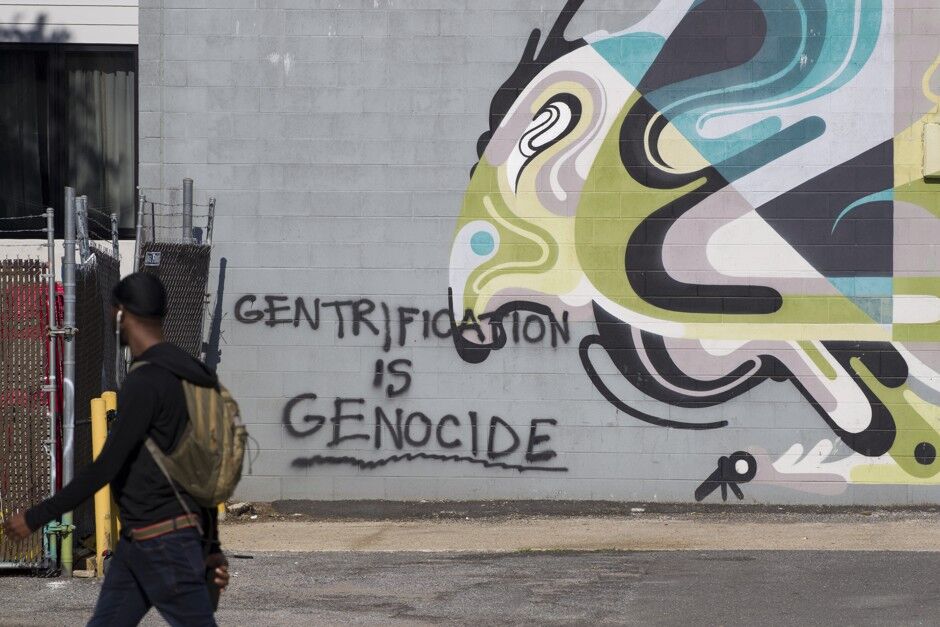
Locate an element on the screen. art is located at coordinates (x=566, y=194).